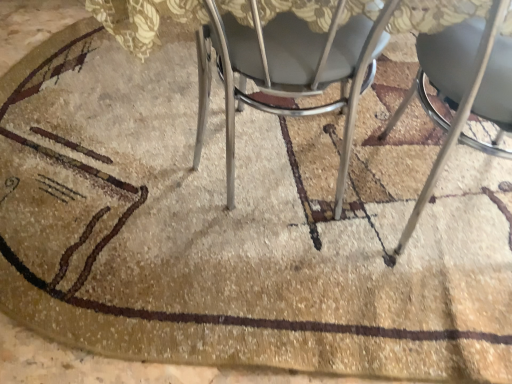
Question: Can you confirm if metallic silver chair at center, the second chair from the right, is shorter than metallic silver chair at lower right, acting as the 2th chair starting from the left?

Choices:
 (A) no
 (B) yes

Answer: (B)

Question: From a real-world perspective, is metallic silver chair at center, placed as the first chair when sorted from left to right, on top of metallic silver chair at lower right, acting as the 2th chair starting from the left?

Choices:
 (A) yes
 (B) no

Answer: (B)

Question: Does metallic silver chair at center, placed as the first chair when sorted from left to right, come in front of metallic silver chair at lower right, acting as the 2th chair starting from the left?

Choices:
 (A) no
 (B) yes

Answer: (A)

Question: Considering the relative positions of metallic silver chair at center, placed as the first chair when sorted from left to right, and metallic silver chair at lower right, placed as the first chair when sorted from right to left, in the image provided, is metallic silver chair at center, placed as the first chair when sorted from left to right, behind metallic silver chair at lower right, placed as the first chair when sorted from right to left,?

Choices:
 (A) no
 (B) yes

Answer: (B)

Question: From a real-world perspective, is metallic silver chair at center, the second chair from the right, located beneath metallic silver chair at lower right, placed as the first chair when sorted from right to left?

Choices:
 (A) no
 (B) yes

Answer: (B)

Question: From the image's perspective, does metallic silver chair at center, the second chair from the right, appear higher than metallic silver chair at lower right, placed as the first chair when sorted from right to left?

Choices:
 (A) no
 (B) yes

Answer: (B)

Question: Is metallic silver chair at lower right, placed as the first chair when sorted from right to left, further to camera compared to metallic silver chair at center, the second chair from the right?

Choices:
 (A) yes
 (B) no

Answer: (B)

Question: From the image's perspective, is metallic silver chair at lower right, placed as the first chair when sorted from right to left, below metallic silver chair at center, the second chair from the right?

Choices:
 (A) yes
 (B) no

Answer: (A)

Question: Does metallic silver chair at lower right, acting as the 2th chair starting from the left, have a smaller size compared to metallic silver chair at center, placed as the first chair when sorted from left to right?

Choices:
 (A) no
 (B) yes

Answer: (B)

Question: From a real-world perspective, is metallic silver chair at lower right, placed as the first chair when sorted from right to left, physically above metallic silver chair at center, placed as the first chair when sorted from left to right?

Choices:
 (A) no
 (B) yes

Answer: (B)

Question: Is metallic silver chair at lower right, acting as the 2th chair starting from the left, thinner than metallic silver chair at center, the second chair from the right?

Choices:
 (A) no
 (B) yes

Answer: (B)

Question: Is metallic silver chair at center, the second chair from the right, at the back of metallic silver chair at lower right, placed as the first chair when sorted from right to left?

Choices:
 (A) yes
 (B) no

Answer: (B)

Question: Is metallic silver chair at lower right, acting as the 2th chair starting from the left, wider or thinner than metallic silver chair at center, placed as the first chair when sorted from left to right?

Choices:
 (A) wide
 (B) thin

Answer: (B)